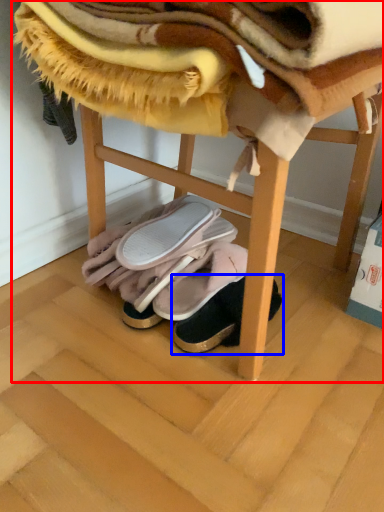
Question: Which of the following is the farthest to the observer, furniture (highlighted by a red box) or footwear (highlighted by a blue box)?

Choices:
 (A) furniture
 (B) footwear

Answer: (B)